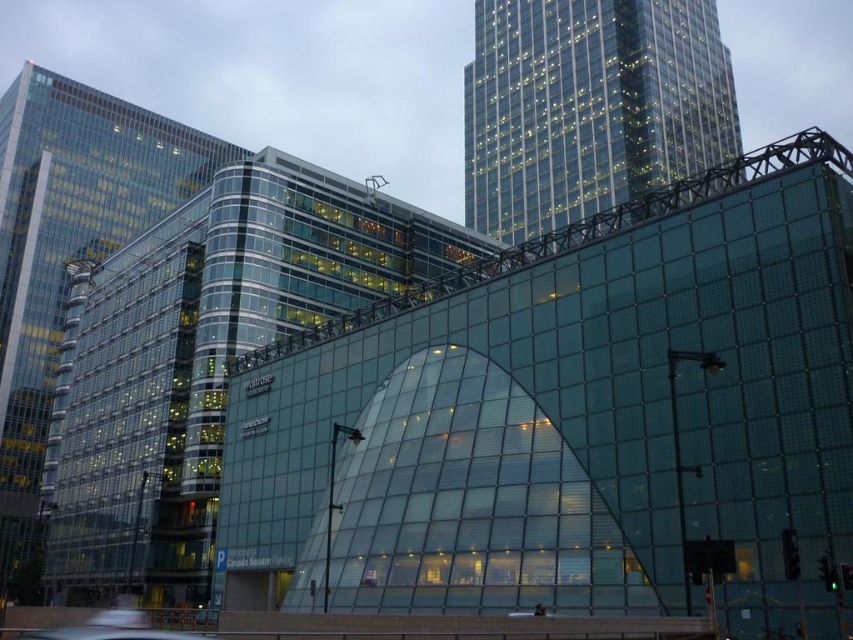
Consider the image. You are standing at the entrance of the transparent glass building at center. Looking towards the two taller skyscrapers in the background, which direction should you face to see them clearly?

Since the transparent glass building at center is located at point (206, 358), the two taller skyscrapers in the background are positioned behind it. Therefore, you should face away from the entrance towards the direction of the skyscrapers to see them clearly.

You are standing in the urban landscape scene and want to determine which of the two points, point (592, 72) or point (125, 152), is nearer to you. Based on the scene description, which point is closer?

Point (592, 72) is closer to the viewer than point (125, 152).

You are standing in the middle of the city square and see the transparent glass building at center and the transparent glass building at left. Which building is positioned to the right of the other?

The transparent glass building at center is positioned to the right of the transparent glass building at left.